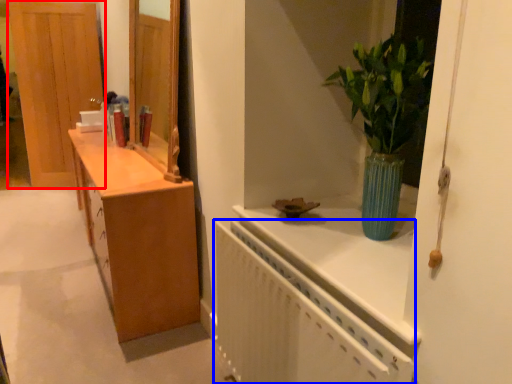
Question: Which object appears closest to the camera in this image, door (highlighted by a red box) or radiator (highlighted by a blue box)?

Choices:
 (A) door
 (B) radiator

Answer: (B)